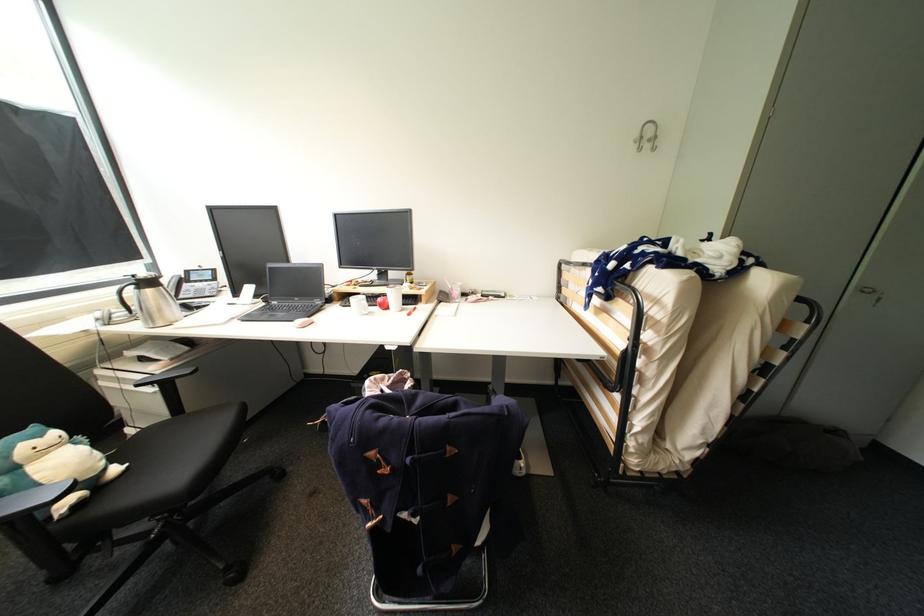
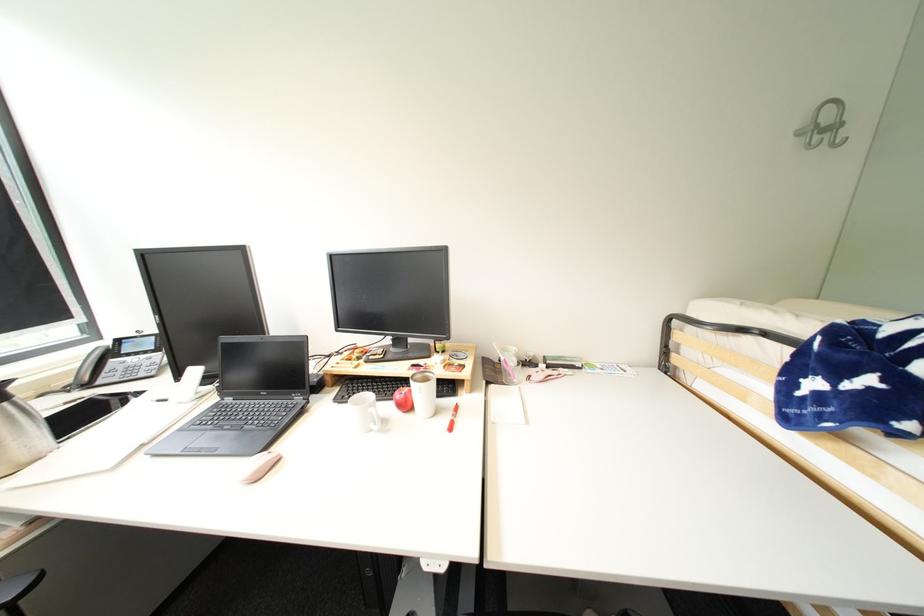
Question: I am providing you with two images of the same scene from different viewpoints. Which of the following objects are not visible in image2?

Choices:
 (A) red apple
 (B) white coffee mug
 (C) phone handset
 (D) none of these

Answer: (D)